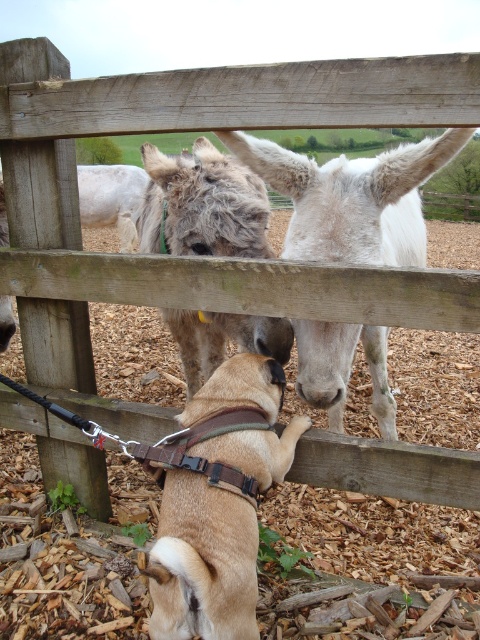
You are standing at the point marked by the coordinates point [351,196] in the image. Looking around, you see the white matte donkey at center. What is the nearest object to you in this scene?

The nearest object to you at point [351,196] is the white matte donkey at center since the coordinates directly indicate its location.

You are a farmer who needs to attach a leash to the brown leather harness at lower center to guide the fuzzy gray mule at center. The leash you have is 24 inches long. Will the leash be long enough to reach the mule without moving the harness?

The brown leather harness at lower center is 22.80 inches from the fuzzy gray mule at center. Since the leash is 24 inches long, it is 1.2 inches longer than the distance between them. Therefore, the leash will be long enough to reach the mule without moving the harness.

You are a farmer checking the equipment. You have a brown leather harness at lower center and a fuzzy gray mule at center. Which one is shorter?

The brown leather harness at lower center is shorter than the fuzzy gray mule at center.